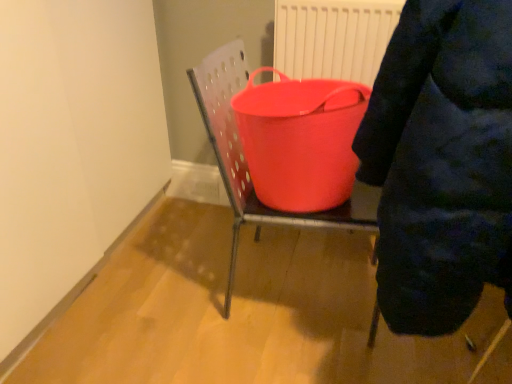
What are the coordinates of `free region under rubberized plastic bucket at center (from a real-world perspective)` in the screenshot? It's located at (295, 279).